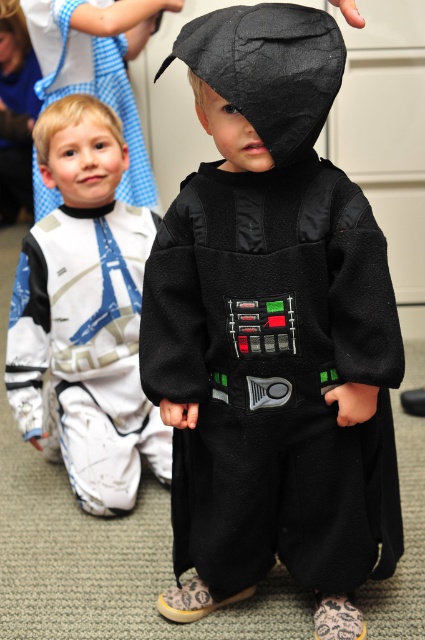
Is felt black costume at center bigger than white fleece costume at upper left?

Correct, felt black costume at center is larger in size than white fleece costume at upper left.

Locate an element on the screen. Image resolution: width=425 pixels, height=640 pixels. felt black costume at center is located at coordinates (272, 332).

Between point (285, 172) and point (155, 204), which one is positioned behind?

Positioned behind is point (155, 204).

Identify the location of felt black costume at center. Image resolution: width=425 pixels, height=640 pixels. (272, 332).

Identify the location of felt black costume at center. (272, 332).

Does felt black costume at center lie behind matte black costume at center?

That is False.

Where is `felt black costume at center`? felt black costume at center is located at coordinates (272, 332).

The image size is (425, 640). Describe the element at coordinates (85, 312) in the screenshot. I see `matte black costume at center` at that location.

Who is more distant from viewer, (70,369) or (28,6)?

The point (28,6) is behind.

Does point (125, 301) come in front of point (116, 42)?

Yes, it is in front of point (116, 42).

Identify the location of matte black costume at center. (85, 312).